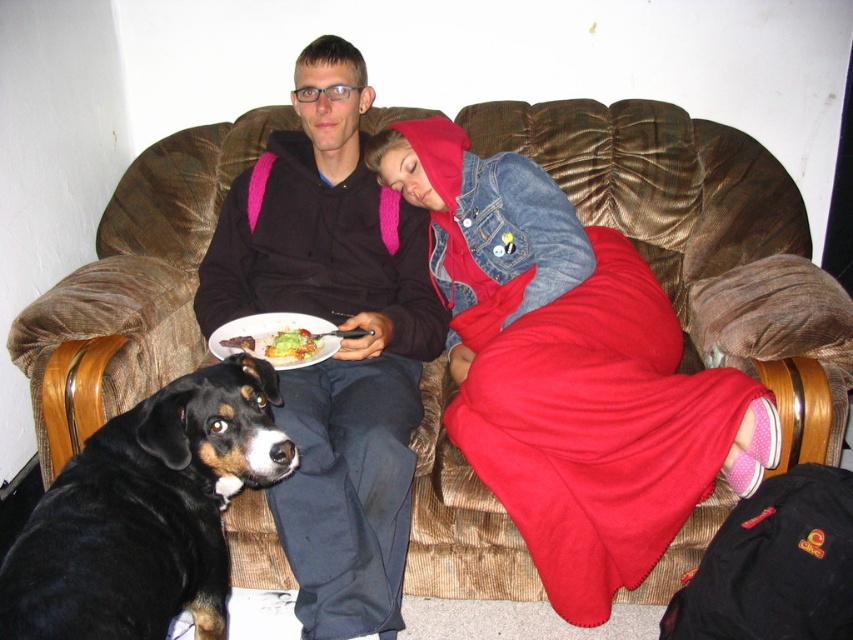
You are standing in the room and want to place a small plant pot at point (x=569, y=371). However, there is an object already there. What object is blocking the spot?

The denim jacket at upper right is blocking the spot at point (x=569, y=371).

You are an interior designer analyzing the placement of furniture in this living room. The denim jacket at upper right is positioned at coordinates 0.580, 0.668. What does this coordinate indicate about the jacket?

The coordinates [569,371] indicate that the denim jacket at upper right is located in the upper right area of the image.